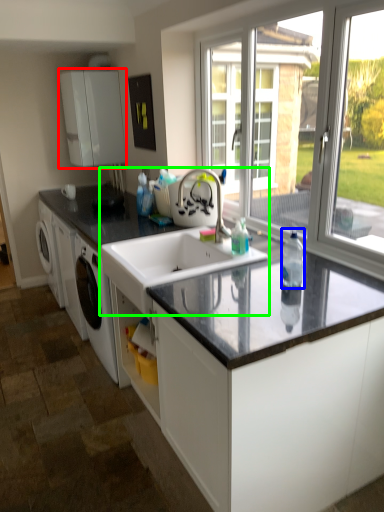
Question: Considering the real-world distances, which object is closest to cabinetry (highlighted by a red box)? bottle (highlighted by a blue box) or sink (highlighted by a green box).

Choices:
 (A) bottle
 (B) sink

Answer: (B)